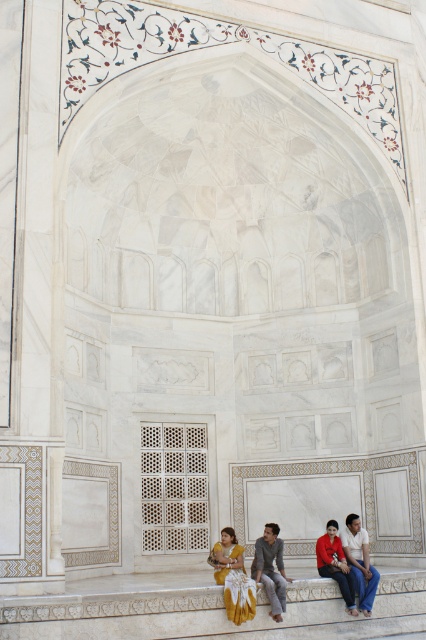
You are standing in front of the Taj Mahal and want to place a small souvenir on the white marble ledge at lower center. Based on the coordinates provided, where exactly should you place it?

The white marble ledge at lower center is located at coordinates [161,609], so place the souvenir at that exact point.

You are an architect examining the Taj Mahal structure. You notice the white marble person at lower right and the matte red shirt at lower right. Which object is placed higher in the scene?

The white marble person at lower right is positioned over the matte red shirt at lower right, so it is higher in the scene.

You are a tour guide leading a group at the Taj Mahal. You notice two tourists, one dressed in a white marble person at lower right and another in a matte red shirt at lower right, sitting on a bench. If you want to ensure they can hear your explanation clearly, how far apart are they sitting?

The white marble person at lower right and the matte red shirt at lower right are 2.78 meters apart from each other.